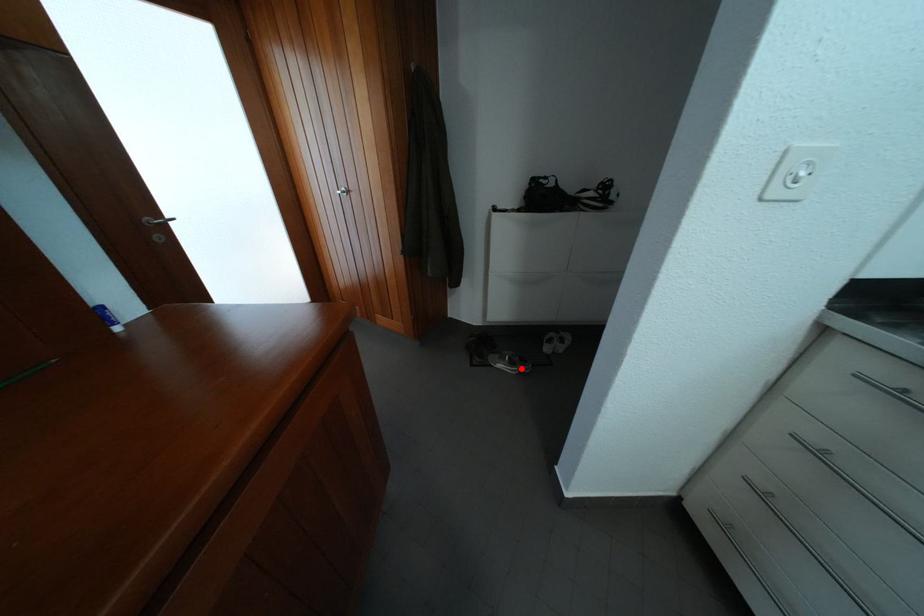
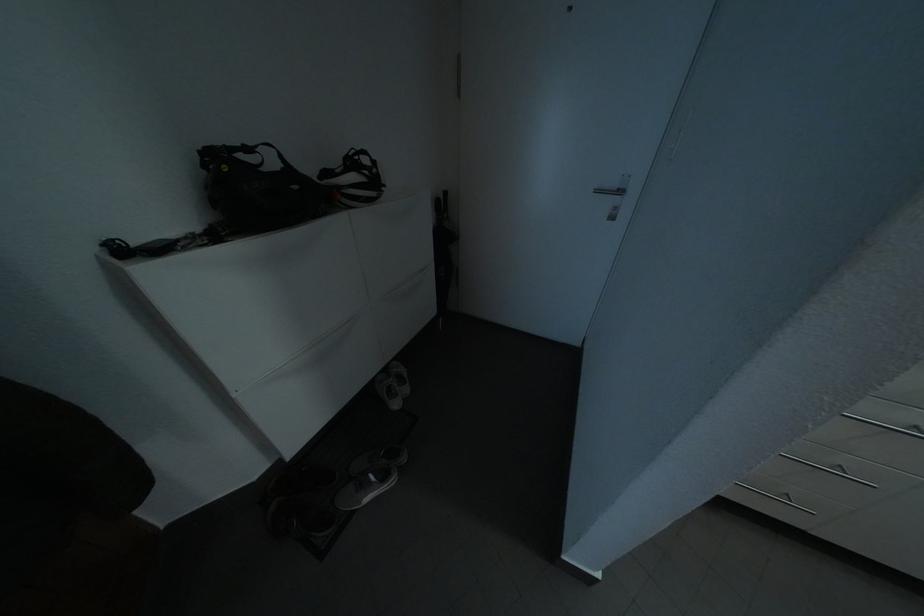
Question: I am providing you with two images of the same scene from different viewpoints. In image1, a red point is highlighted. Considering the same 3D point in image2, which of the following is correct?

Choices:
 (A) It is closer
 (B) It is farther

Answer: (A)